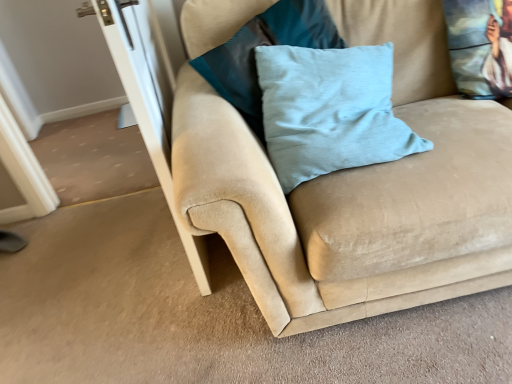
Question: Would you say suede couch at center is a long distance from light blue velvet pillow at center, the second pillow when ordered from right to left?

Choices:
 (A) no
 (B) yes

Answer: (A)

Question: Would you say suede couch at center is outside light blue velvet pillow at center, the second pillow when ordered from right to left?

Choices:
 (A) yes
 (B) no

Answer: (A)

Question: Does suede couch at center appear on the right side of light blue velvet pillow at center, which is the 2th pillow in left-to-right order?

Choices:
 (A) no
 (B) yes

Answer: (B)

Question: Is suede couch at center closer to camera compared to light blue velvet pillow at center, which is the 2th pillow in left-to-right order?

Choices:
 (A) no
 (B) yes

Answer: (B)

Question: Is suede couch at center at the left side of light blue velvet pillow at center, the second pillow when ordered from right to left?

Choices:
 (A) no
 (B) yes

Answer: (A)

Question: Choose the correct answer: Is printed fabric cushion at upper right, which appears as the first pillow when viewed from the right, inside light blue fabric pillow at center, the first pillow positioned from the left, or outside it?

Choices:
 (A) inside
 (B) outside

Answer: (B)

Question: From the image's perspective, is printed fabric cushion at upper right, which is the third pillow in left-to-right order, above or below light blue fabric pillow at center, the first pillow positioned from the left?

Choices:
 (A) below
 (B) above

Answer: (B)

Question: Considering the positions of printed fabric cushion at upper right, which appears as the first pillow when viewed from the right, and light blue fabric pillow at center, which ranks as the 3th pillow in right-to-left order, in the image, is printed fabric cushion at upper right, which appears as the first pillow when viewed from the right, taller or shorter than light blue fabric pillow at center, which ranks as the 3th pillow in right-to-left order,?

Choices:
 (A) tall
 (B) short

Answer: (B)

Question: Is printed fabric cushion at upper right, which is the third pillow in left-to-right order, to the left or to the right of light blue fabric pillow at center, which ranks as the 3th pillow in right-to-left order, in the image?

Choices:
 (A) left
 (B) right

Answer: (B)

Question: From a real-world perspective, is light blue velvet pillow at center, which is the 2th pillow in left-to-right order, positioned above or below light blue fabric pillow at center, which ranks as the 3th pillow in right-to-left order?

Choices:
 (A) below
 (B) above

Answer: (A)

Question: Would you say light blue velvet pillow at center, the second pillow when ordered from right to left, is inside or outside light blue fabric pillow at center, which ranks as the 3th pillow in right-to-left order?

Choices:
 (A) outside
 (B) inside

Answer: (A)

Question: In terms of height, does light blue velvet pillow at center, the second pillow when ordered from right to left, look taller or shorter compared to light blue fabric pillow at center, the first pillow positioned from the left?

Choices:
 (A) short
 (B) tall

Answer: (A)

Question: Is light blue velvet pillow at center, which is the 2th pillow in left-to-right order, wider or thinner than light blue fabric pillow at center, which ranks as the 3th pillow in right-to-left order?

Choices:
 (A) wide
 (B) thin

Answer: (A)

Question: Considering the positions of point (359, 102) and point (129, 61), is point (359, 102) closer or farther from the camera than point (129, 61)?

Choices:
 (A) farther
 (B) closer

Answer: (A)

Question: From their relative heights in the image, would you say light blue velvet pillow at center, which is the 2th pillow in left-to-right order, is taller or shorter than transparent glass screen door at left?

Choices:
 (A) tall
 (B) short

Answer: (B)